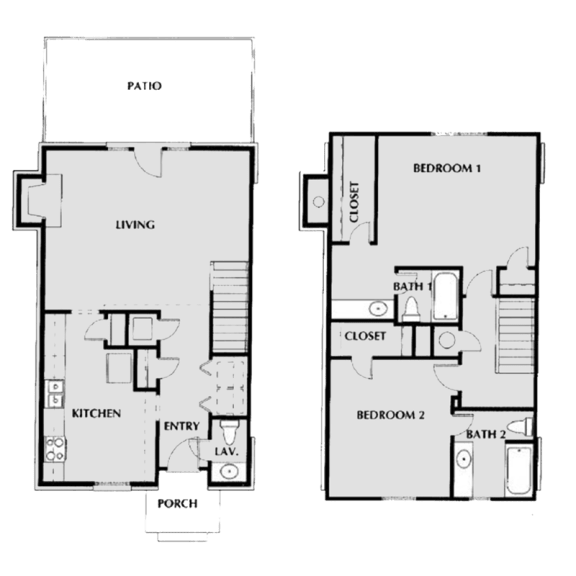
This screenshot has width=576, height=576. I want to click on bathtubs, so click(448, 297), click(519, 482).